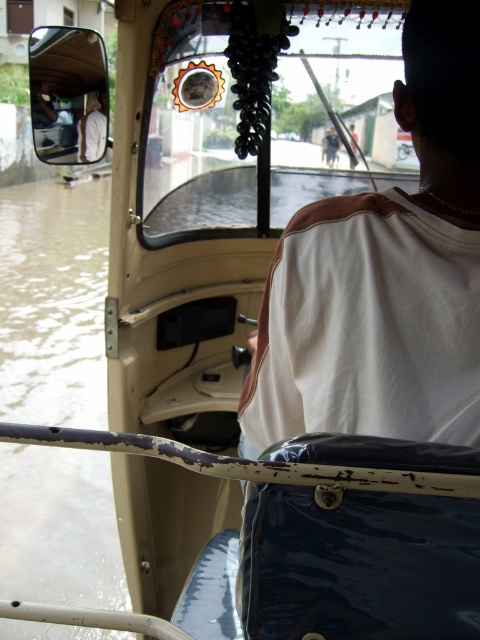
Can you confirm if white fabric shirt at left is taller than dark brown leather jacket at upper center?

In fact, white fabric shirt at left may be shorter than dark brown leather jacket at upper center.

Looking at this image, is white fabric shirt at left to the left of dark brown leather jacket at upper center from the viewer's perspective?

Yes, white fabric shirt at left is to the left of dark brown leather jacket at upper center.

Who is more distant from viewer, (97,109) or (336,148)?

The point (336,148) is more distant.

Identify the location of white fabric shirt at left. (92, 128).